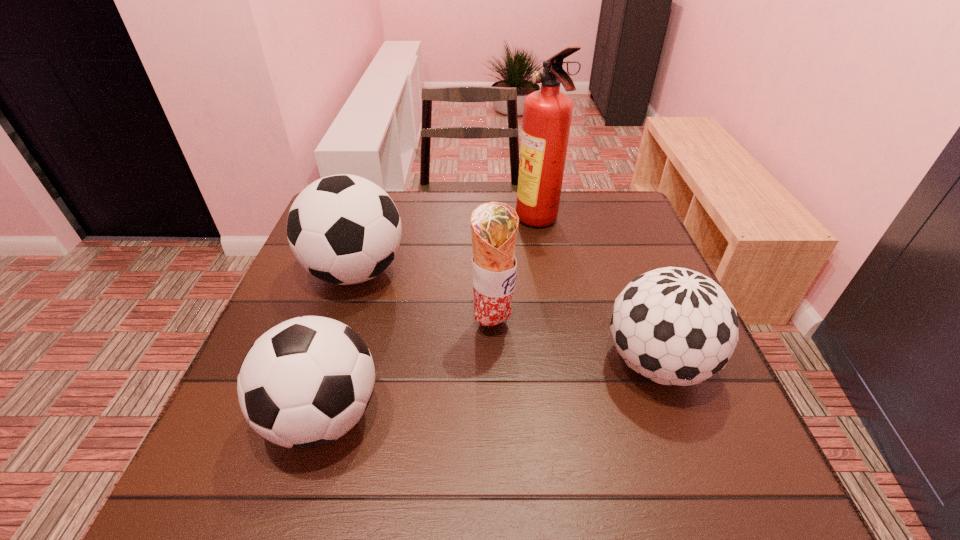
This screenshot has width=960, height=540. In order to click on vacant area situated 0.300m on the left of the rightmost object in this screenshot , I will do `click(452, 363)`.

The width and height of the screenshot is (960, 540). Identify the location of object that is at the far edge. (547, 113).

The width and height of the screenshot is (960, 540). Identify the location of object that is at the near edge. (306, 382).

The image size is (960, 540). I want to click on object that is at the right edge, so click(674, 326).

Locate an element on the screen. The width and height of the screenshot is (960, 540). object present at the near left corner is located at coordinates (306, 382).

Locate an element on the screen. The height and width of the screenshot is (540, 960). free spot at the far edge of the desktop is located at coordinates (463, 202).

In the image, there is a desktop. At what (x,y) coordinates should I click in order to perform the action: click on vacant space at the left edge. Please return your answer as a coordinate pair (x, y). This screenshot has width=960, height=540. Looking at the image, I should click on [298, 283].

Locate an element on the screen. The width and height of the screenshot is (960, 540). vacant area at the right edge of the desktop is located at coordinates (630, 243).

Image resolution: width=960 pixels, height=540 pixels. I want to click on free space at the near left corner, so click(x=203, y=467).

Where is `vacant space at the far right corner`? Image resolution: width=960 pixels, height=540 pixels. vacant space at the far right corner is located at coordinates (586, 200).